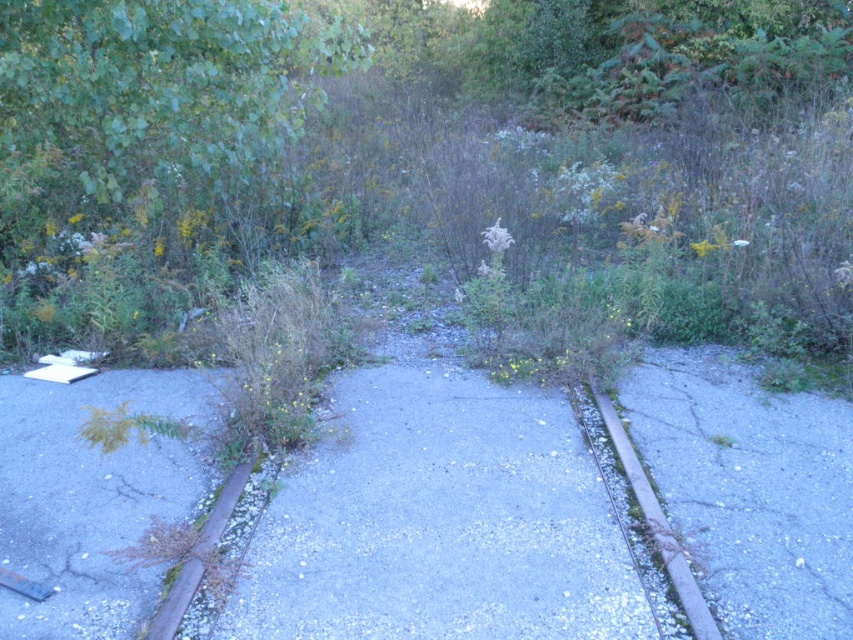
You are standing at the old railroad tracks and want to walk to the gray concrete pavement at center. According to the coordinates provided, in which direction should you move relative to the tracks?

The gray concrete pavement at center is located at point (439, 522), which means it is positioned to the right and slightly forward relative to your current position at the tracks. Move in that direction.

You are a delivery person trying to navigate a narrow path between the gray concrete pavement at center and the rusty metal curb at lower right. Which object should you avoid to stay on the path?

You should avoid the rusty metal curb at lower right because the gray concrete pavement at center is positioned over it, meaning the curb is likely lower and part of the path edge.

You are a delivery person trying to navigate a narrow path between the gray concrete pavement at center and the rusty metal curb at lower right. Which surface should you avoid stepping on to prevent tripping?

You should avoid stepping on the gray concrete pavement at center because it has a greater height compared to the rusty metal curb at lower right, which could cause tripping due to the elevation difference.